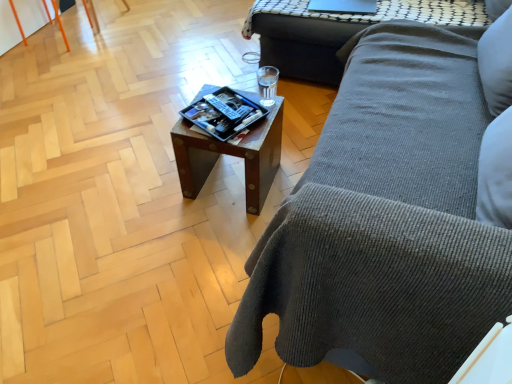
Where is `free space above matte black tray at center (from a real-world perspective)`? This screenshot has width=512, height=384. free space above matte black tray at center (from a real-world perspective) is located at coordinates (222, 110).